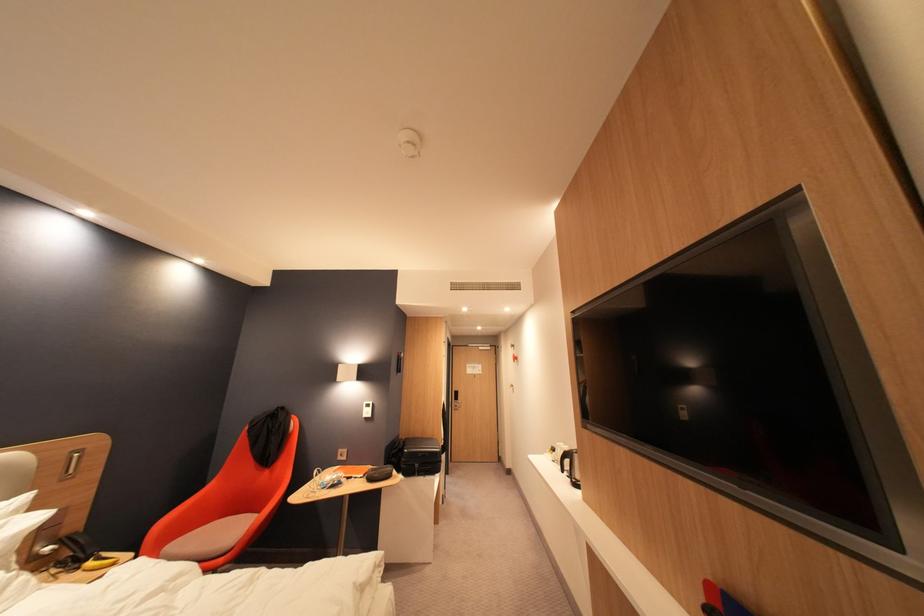
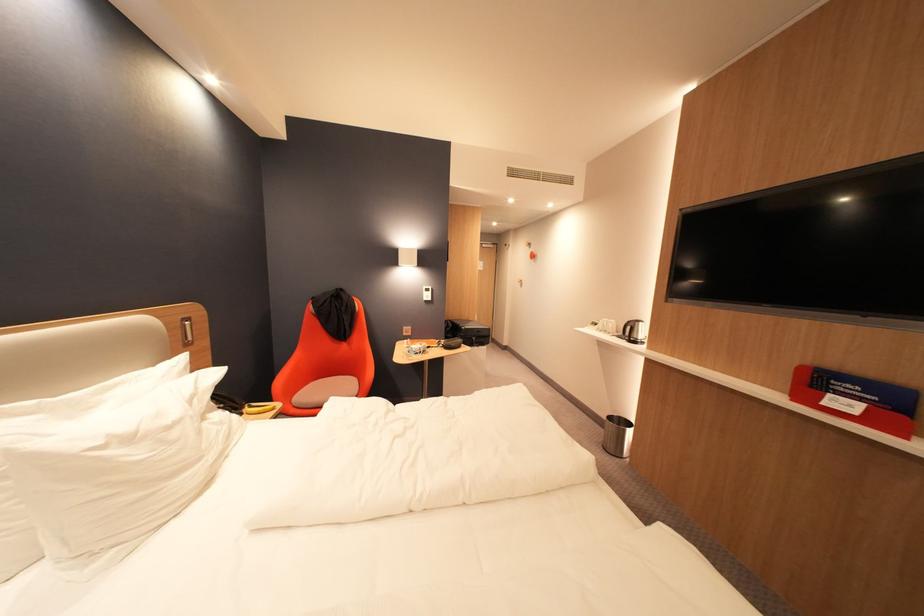
Question: In a continuous first-person perspective shot, in which direction is the camera moving?

Choices:
 (A) Left
 (B) Right
 (C) Forward
 (D) Backward

Answer: (A)